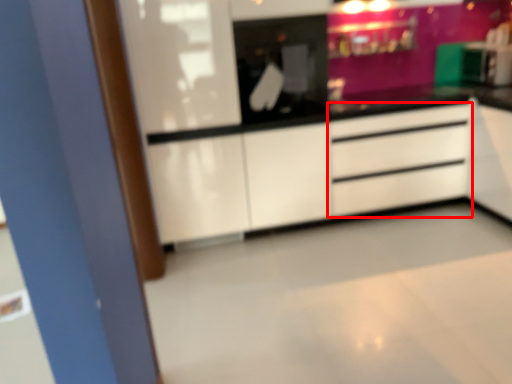
Question: From the image's perspective, where is chest of drawers (annotated by the red box) located relative to appliance?

Choices:
 (A) above
 (B) below

Answer: (B)